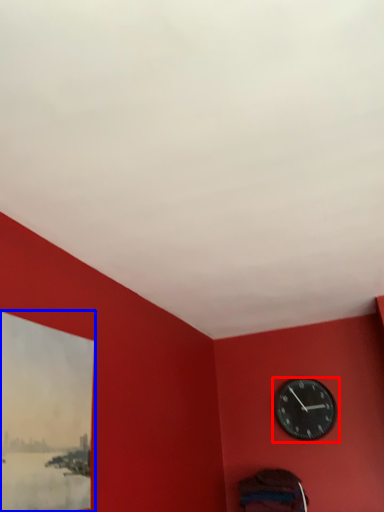
Question: Which object is further to the camera taking this photo, wall clock (highlighted by a red box) or picture frame (highlighted by a blue box)?

Choices:
 (A) wall clock
 (B) picture frame

Answer: (A)